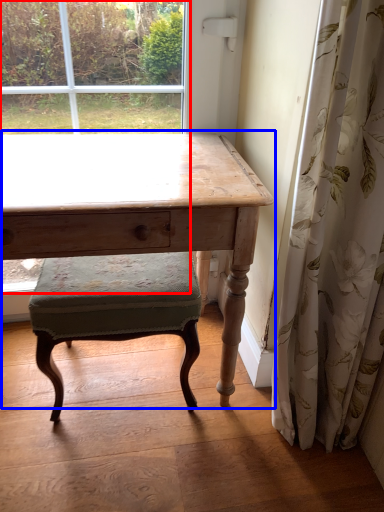
Question: Which point is further to the camera, bay window (highlighted by a red box) or table (highlighted by a blue box)?

Choices:
 (A) bay window
 (B) table

Answer: (A)